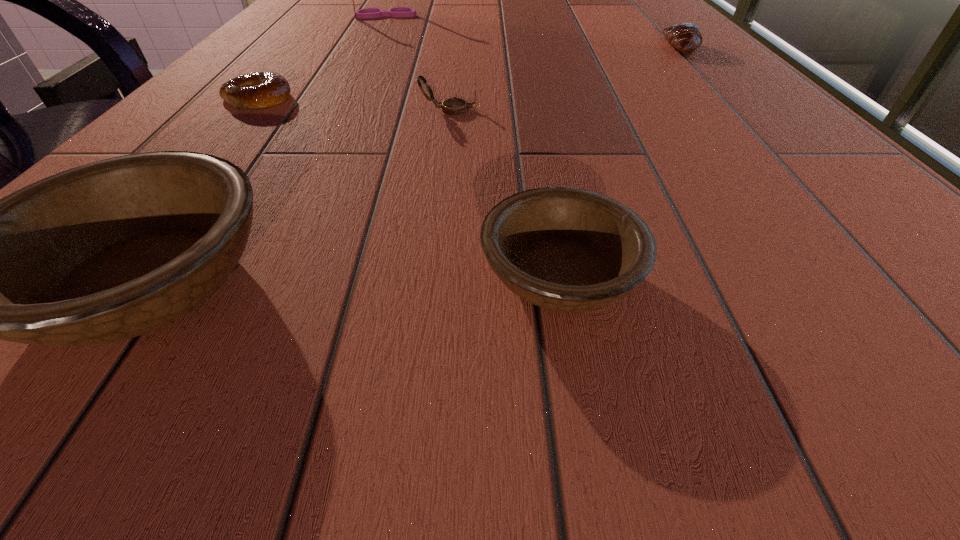
At what (x,y) coordinates should I click in order to perform the action: click on free region that satisfies the following two spatial constraints: 1. on the face of the third object from right to left; 2. on the back side of the fifth object from left to right. Please return your answer as a coordinate pair (x, y). Looking at the image, I should click on (431, 275).